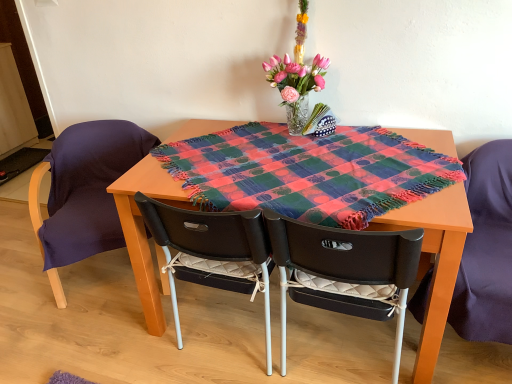
Question: Considering the relative sizes of multicolored woven blanket at center and purple fabric chair at left, which appears as the 4th chair when viewed from the right, in the image provided, is multicolored woven blanket at center taller than purple fabric chair at left, which appears as the 4th chair when viewed from the right,?

Choices:
 (A) yes
 (B) no

Answer: (B)

Question: From the image's perspective, is multicolored woven blanket at center beneath purple fabric chair at left, which appears as the 4th chair when viewed from the right?

Choices:
 (A) no
 (B) yes

Answer: (A)

Question: Is multicolored woven blanket at center at the left side of purple fabric chair at left, placed as the 1th chair when sorted from left to right?

Choices:
 (A) yes
 (B) no

Answer: (B)

Question: From the image's perspective, is multicolored woven blanket at center on top of purple fabric chair at left, placed as the 1th chair when sorted from left to right?

Choices:
 (A) no
 (B) yes

Answer: (B)

Question: Is multicolored woven blanket at center bigger than purple fabric chair at left, placed as the 1th chair when sorted from left to right?

Choices:
 (A) yes
 (B) no

Answer: (B)

Question: Based on their positions, is black quilted cushion at center, the second chair positioned from the right, located to the left or right of matte black chair at right, the first chair positioned from the right?

Choices:
 (A) right
 (B) left

Answer: (B)

Question: In terms of height, does black quilted cushion at center, which is the 3th chair in left-to-right order, look taller or shorter compared to matte black chair at right, the first chair positioned from the right?

Choices:
 (A) tall
 (B) short

Answer: (B)

Question: Based on their sizes in the image, would you say black quilted cushion at center, which is the 3th chair in left-to-right order, is bigger or smaller than matte black chair at right, the first chair positioned from the right?

Choices:
 (A) small
 (B) big

Answer: (B)

Question: Considering the positions of point (303, 236) and point (479, 201), is point (303, 236) closer or farther from the camera than point (479, 201)?

Choices:
 (A) closer
 (B) farther

Answer: (A)

Question: Is pink glass vase at upper center situated inside purple fabric chair at left, placed as the 1th chair when sorted from left to right, or outside?

Choices:
 (A) inside
 (B) outside

Answer: (B)

Question: Does point (287, 109) appear closer or farther from the camera than point (96, 230)?

Choices:
 (A) closer
 (B) farther

Answer: (A)

Question: In the image, is pink glass vase at upper center on the left side or the right side of purple fabric chair at left, placed as the 1th chair when sorted from left to right?

Choices:
 (A) left
 (B) right

Answer: (B)

Question: Based on their sizes in the image, would you say pink glass vase at upper center is bigger or smaller than purple fabric chair at left, placed as the 1th chair when sorted from left to right?

Choices:
 (A) small
 (B) big

Answer: (A)

Question: Based on their sizes in the image, would you say black quilted cushion at center, the second chair positioned from the right, is bigger or smaller than purple fabric chair at left, which appears as the 4th chair when viewed from the right?

Choices:
 (A) small
 (B) big

Answer: (A)

Question: From a real-world perspective, is black quilted cushion at center, which is the 3th chair in left-to-right order, above or below purple fabric chair at left, placed as the 1th chair when sorted from left to right?

Choices:
 (A) below
 (B) above

Answer: (B)